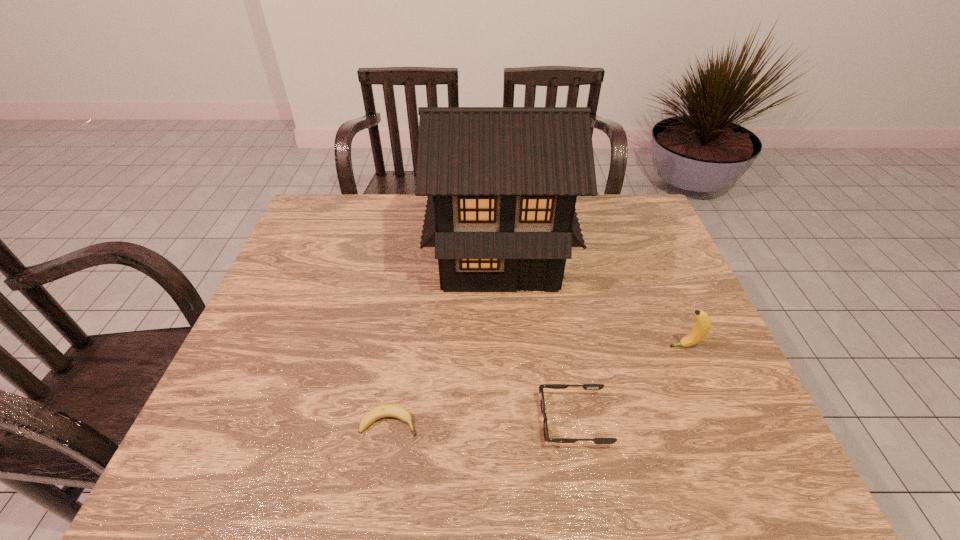
You are a GUI agent. You are given a task and a screenshot of the screen. Output one action in this format:
    pyautogui.click(x=<x>, y=<y>)
    Task: Click on the vacant space at the left edge
    The height and width of the screenshot is (540, 960).
    Given the screenshot: What is the action you would take?
    pyautogui.click(x=250, y=393)

Identify the location of vacant region at the right edge. (640, 254).

At what (x,y) coordinates should I click in order to perform the action: click on vacant space at the near left corner of the desktop. Please return your answer as a coordinate pair (x, y). Image resolution: width=960 pixels, height=540 pixels. Looking at the image, I should click on (208, 441).

This screenshot has height=540, width=960. I want to click on vacant space at the far right corner of the desktop, so click(606, 195).

Where is `free space between the left banana and the farthest object`? free space between the left banana and the farthest object is located at coordinates (444, 338).

This screenshot has width=960, height=540. What are the coordinates of `free space between the farthest object and the shortest object` in the screenshot? It's located at (444, 338).

The image size is (960, 540). In order to click on empty space that is in between the farther banana and the shortest object in this screenshot , I will do `click(538, 384)`.

Where is `free space between the taller banana and the dollhouse`? The width and height of the screenshot is (960, 540). free space between the taller banana and the dollhouse is located at coordinates (592, 300).

This screenshot has width=960, height=540. What are the coordinates of `empty location between the left banana and the third shortest object` in the screenshot? It's located at (538, 384).

Where is `free spot between the taller banana and the farthest object`? free spot between the taller banana and the farthest object is located at coordinates [592, 300].